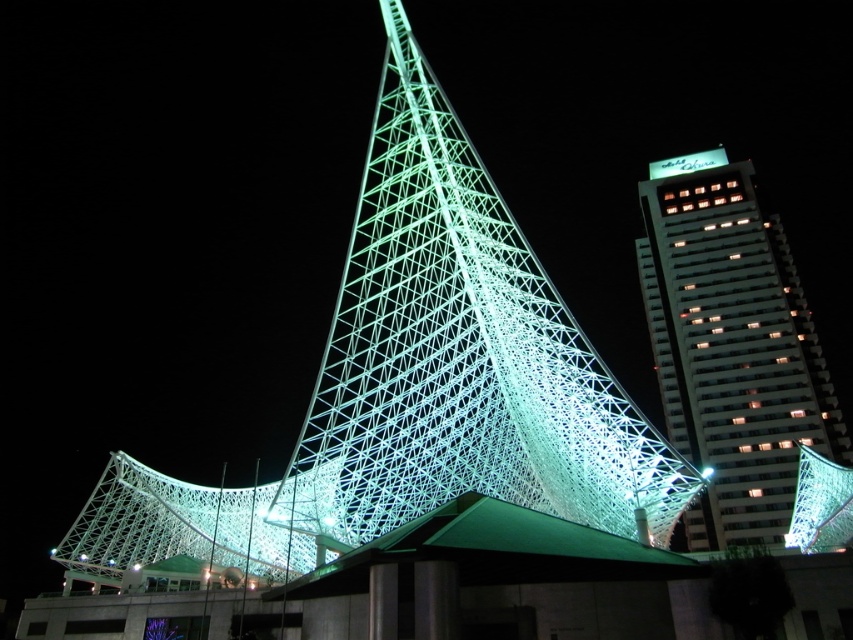
Question: Does illuminated mesh structure at center come in front of white glass skyscraper at upper right?

Choices:
 (A) no
 (B) yes

Answer: (B)

Question: Is illuminated mesh structure at center to the right of white glass skyscraper at upper right from the viewer's perspective?

Choices:
 (A) no
 (B) yes

Answer: (A)

Question: Which point is farther to the camera?

Choices:
 (A) (677, 156)
 (B) (508, 248)

Answer: (A)

Question: Is illuminated mesh structure at center below white glass skyscraper at upper right?

Choices:
 (A) no
 (B) yes

Answer: (B)

Question: Which is farther from the white glass skyscraper at upper right?

Choices:
 (A) illuminated mesh structure at center
 (B) green illuminated sign at upper right

Answer: (A)

Question: Which of these objects is positioned closest to the white glass skyscraper at upper right?

Choices:
 (A) green illuminated sign at upper right
 (B) illuminated mesh structure at center

Answer: (A)